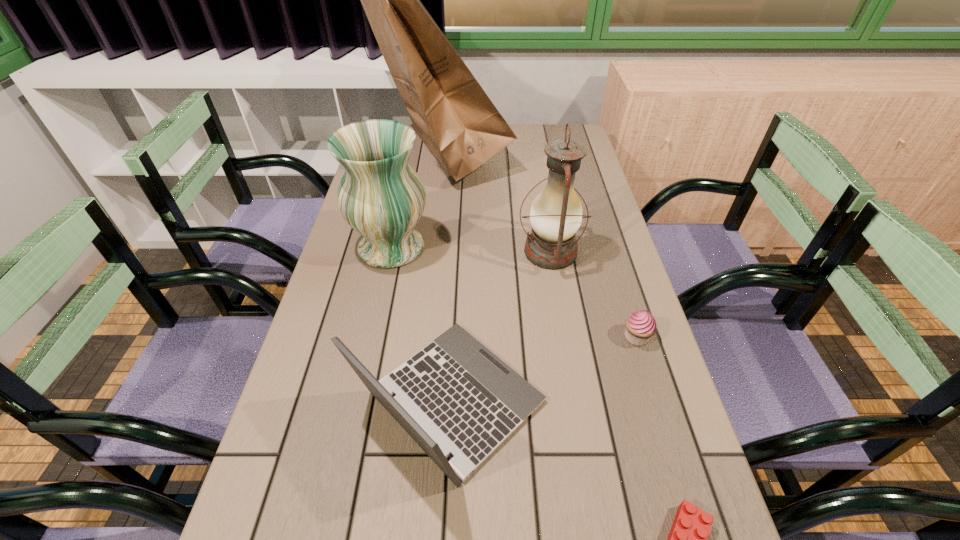
I want to click on free region located on the front of the cupcake, so click(x=666, y=434).

The image size is (960, 540). Find the location of `object that is at the far edge`. object that is at the far edge is located at coordinates (451, 113).

At what (x,y) coordinates should I click in order to perform the action: click on grocery bag present at the left edge. Please return your answer as a coordinate pair (x, y). The width and height of the screenshot is (960, 540). Looking at the image, I should click on (451, 113).

Find the location of a particular element. vase that is at the left edge is located at coordinates (380, 195).

Identify the location of laptop_computer located in the left edge section of the desktop. (455, 396).

The height and width of the screenshot is (540, 960). I want to click on oil lamp that is at the right edge, so click(x=556, y=213).

The width and height of the screenshot is (960, 540). In order to click on cupcake located at the right edge in this screenshot , I will do `click(640, 326)`.

At what (x,y) coordinates should I click in order to perform the action: click on object that is at the far left corner. Please return your answer as a coordinate pair (x, y). This screenshot has height=540, width=960. Looking at the image, I should click on (451, 113).

In the image, there is a desktop. Identify the location of vacant region at the far edge. This screenshot has height=540, width=960. click(x=535, y=150).

Where is `free point at the left edge`? This screenshot has height=540, width=960. free point at the left edge is located at coordinates (318, 404).